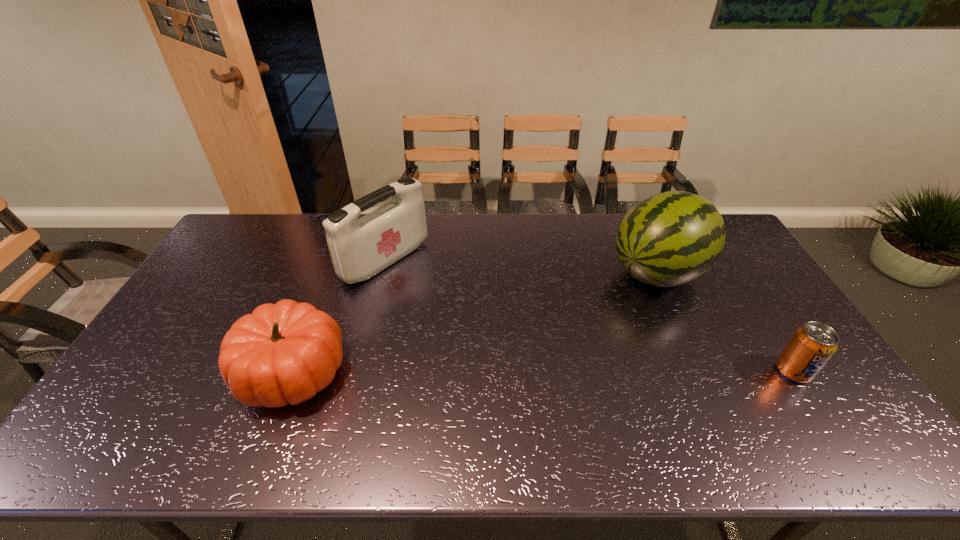
Identify the location of pumpkin. This screenshot has height=540, width=960. (284, 353).

The width and height of the screenshot is (960, 540). What are the coordinates of `soda can` in the screenshot? It's located at (812, 345).

Locate an element on the screen. the shortest object is located at coordinates (812, 345).

Where is `the first-aid kit`? The height and width of the screenshot is (540, 960). the first-aid kit is located at coordinates click(x=360, y=248).

Locate an element on the screen. watermelon is located at coordinates (671, 238).

I want to click on vacant position located on the back of the second shortest object, so click(x=323, y=292).

The width and height of the screenshot is (960, 540). Find the location of `free space located on the back of the rightmost object`. free space located on the back of the rightmost object is located at coordinates (772, 338).

Locate an element on the screen. vacant space located on the front side of the first-aid kit is located at coordinates (452, 306).

This screenshot has height=540, width=960. Identify the location of vacant region located 0.250m on the front side of the first-aid kit. (468, 316).

I want to click on free space located on the front side of the first-aid kit, so click(489, 329).